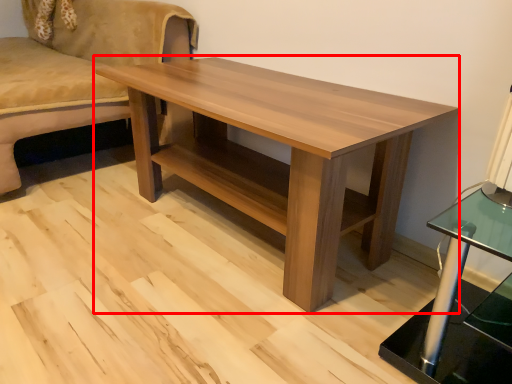
Question: From the image's perspective, what is the correct spatial positioning of coffee table (annotated by the red box) in reference to studio couch?

Choices:
 (A) below
 (B) above

Answer: (A)